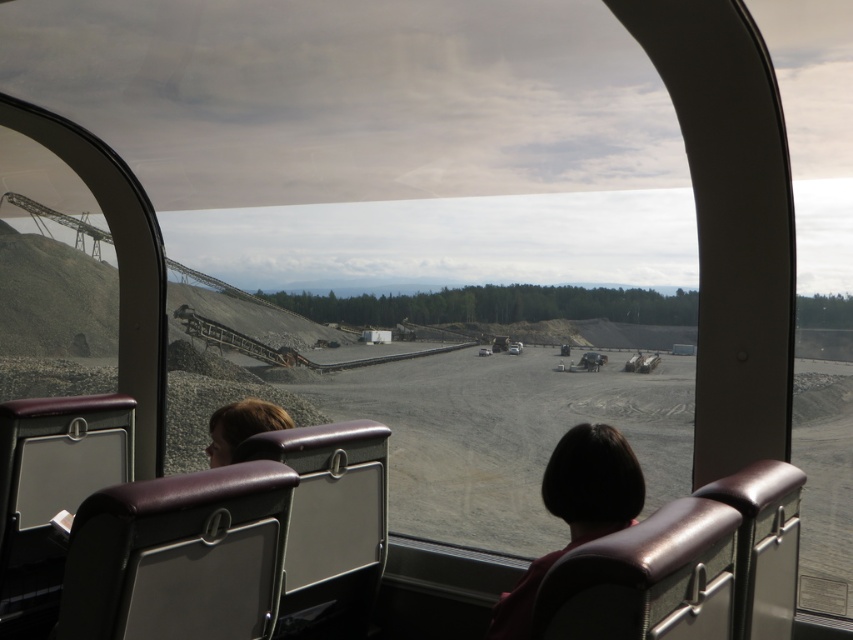
Question: Which point is farther from the camera taking this photo?

Choices:
 (A) (253, 428)
 (B) (583, 525)

Answer: (A)

Question: Is dark brown hair at center to the left of brown hair at left from the viewer's perspective?

Choices:
 (A) yes
 (B) no

Answer: (B)

Question: Can you confirm if dark brown hair at center is smaller than brown hair at left?

Choices:
 (A) yes
 (B) no

Answer: (B)

Question: Among these objects, which one is nearest to the camera?

Choices:
 (A) brown hair at left
 (B) dark brown hair at center

Answer: (B)

Question: Where is dark brown hair at center located in relation to brown hair at left in the image?

Choices:
 (A) above
 (B) below

Answer: (B)